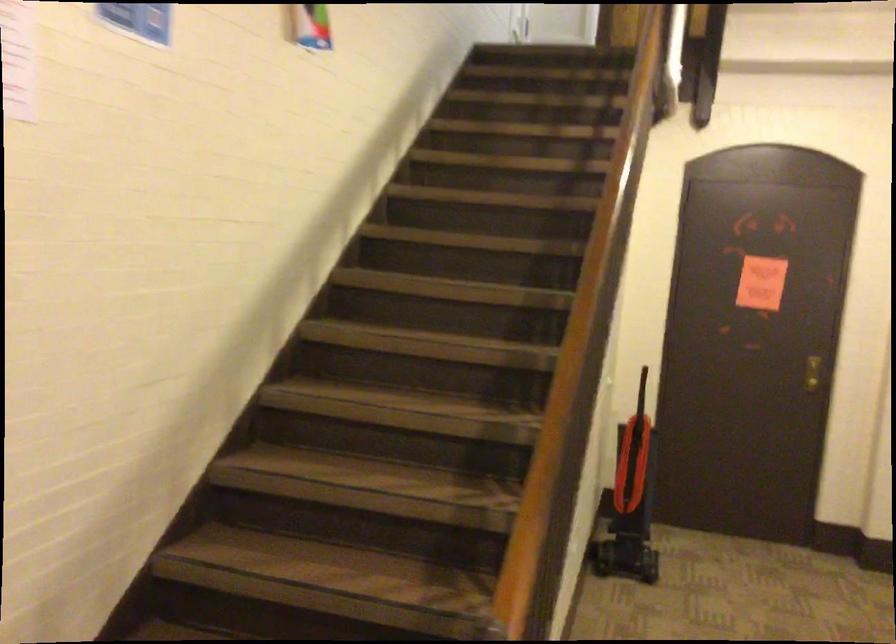
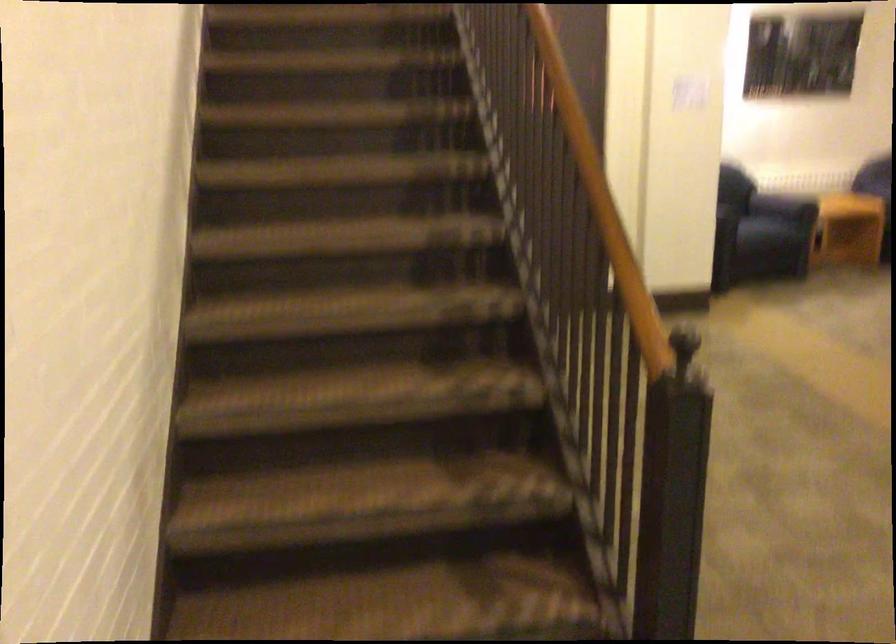
Locate, in the second image, the point that corresponds to the point at 547,451 in the first image.

(608, 216)